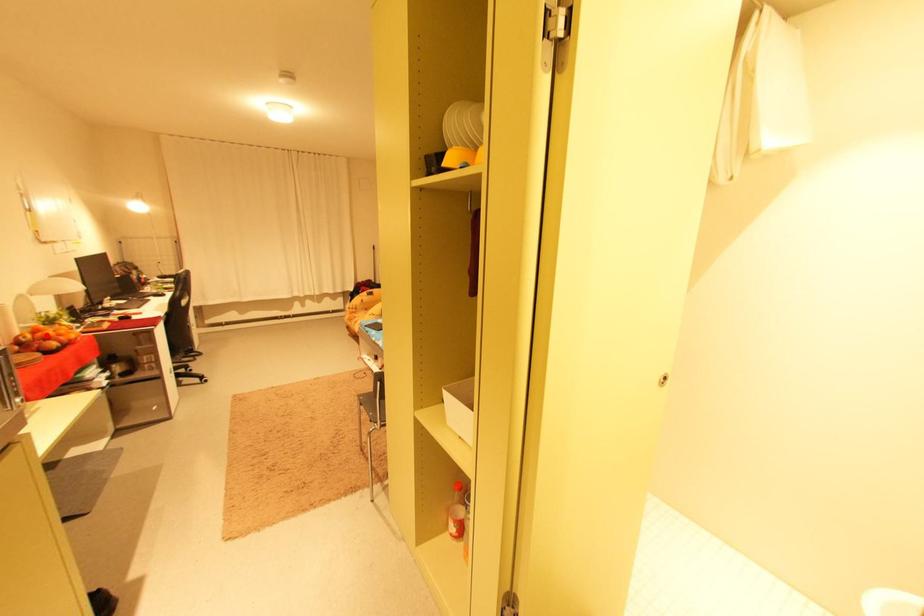
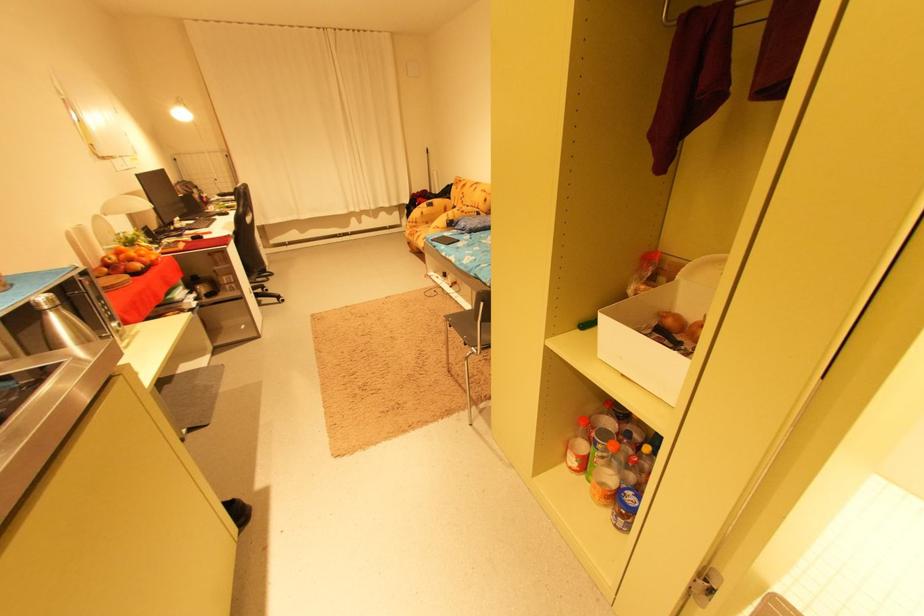
The point at the highlighted location is marked in the first image. Where is the corresponding point in the second image?

(129, 257)